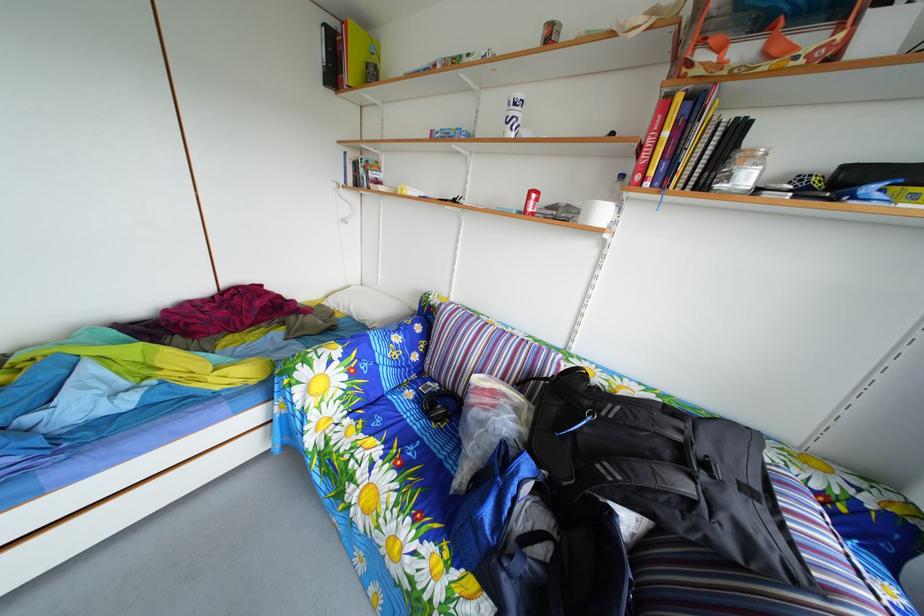
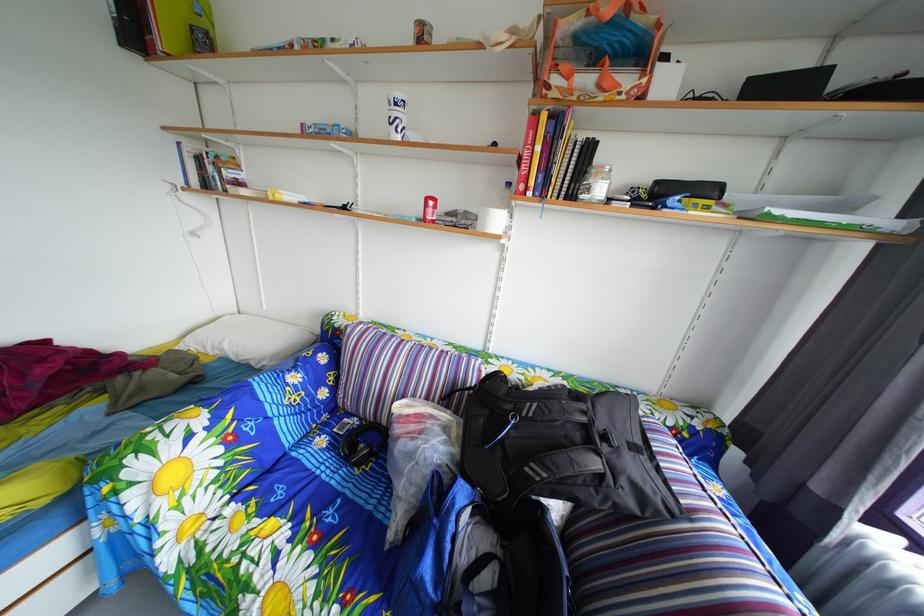
Where in the second image is the point corresponding to point 738,185 from the first image?

(600, 198)